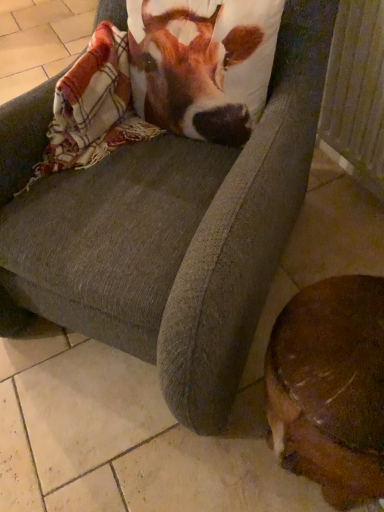
You are a GUI agent. You are given a task and a screenshot of the screen. Output one action in this format:
    pyautogui.click(x=<x>, y=<y>)
    Task: Click on the vacant area situated below wooden radiator at lower right (from a real-world perspective)
    The width and height of the screenshot is (384, 512).
    Given the screenshot: What is the action you would take?
    pyautogui.click(x=349, y=190)